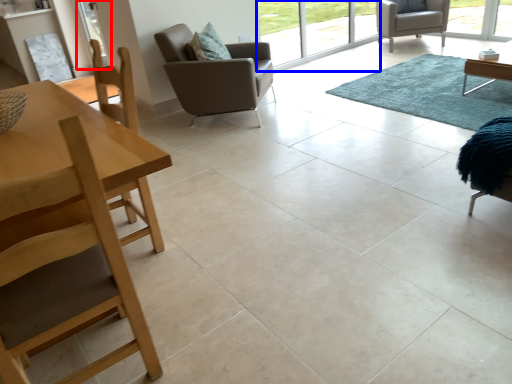
Question: Which point is further to the camera, screen door (highlighted by a red box) or window screen (highlighted by a blue box)?

Choices:
 (A) screen door
 (B) window screen

Answer: (A)